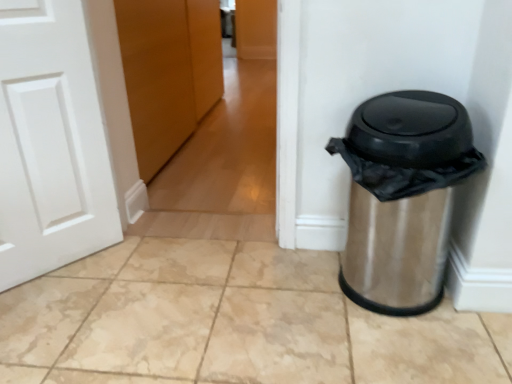
Question: Does stainless steel trash can at right have a greater width compared to wooden door at center?

Choices:
 (A) no
 (B) yes

Answer: (B)

Question: Considering the relative sizes of stainless steel trash can at right and wooden door at center in the image provided, is stainless steel trash can at right bigger than wooden door at center?

Choices:
 (A) yes
 (B) no

Answer: (B)

Question: Is stainless steel trash can at right aimed at wooden door at center?

Choices:
 (A) no
 (B) yes

Answer: (A)

Question: From a real-world perspective, is stainless steel trash can at right located beneath wooden door at center?

Choices:
 (A) no
 (B) yes

Answer: (B)

Question: Does stainless steel trash can at right have a greater height compared to wooden door at center?

Choices:
 (A) yes
 (B) no

Answer: (B)

Question: Is stainless steel trash can at right not inside wooden door at center?

Choices:
 (A) no
 (B) yes

Answer: (B)

Question: From a real-world perspective, is wooden door at center below stainless steel trash can at right?

Choices:
 (A) yes
 (B) no

Answer: (B)

Question: Is wooden door at center thinner than stainless steel trash can at right?

Choices:
 (A) yes
 (B) no

Answer: (A)

Question: Does wooden door at center have a lesser height compared to stainless steel trash can at right?

Choices:
 (A) yes
 (B) no

Answer: (B)

Question: Is stainless steel trash can at right completely or partially inside wooden door at center?

Choices:
 (A) no
 (B) yes

Answer: (A)

Question: Can you see wooden door at center touching stainless steel trash can at right?

Choices:
 (A) no
 (B) yes

Answer: (A)

Question: Is stainless steel trash can at right at the back of wooden door at center?

Choices:
 (A) no
 (B) yes

Answer: (A)

Question: Considering the positions of stainless steel trash can at right and wooden door at center in the image, is stainless steel trash can at right bigger or smaller than wooden door at center?

Choices:
 (A) big
 (B) small

Answer: (B)